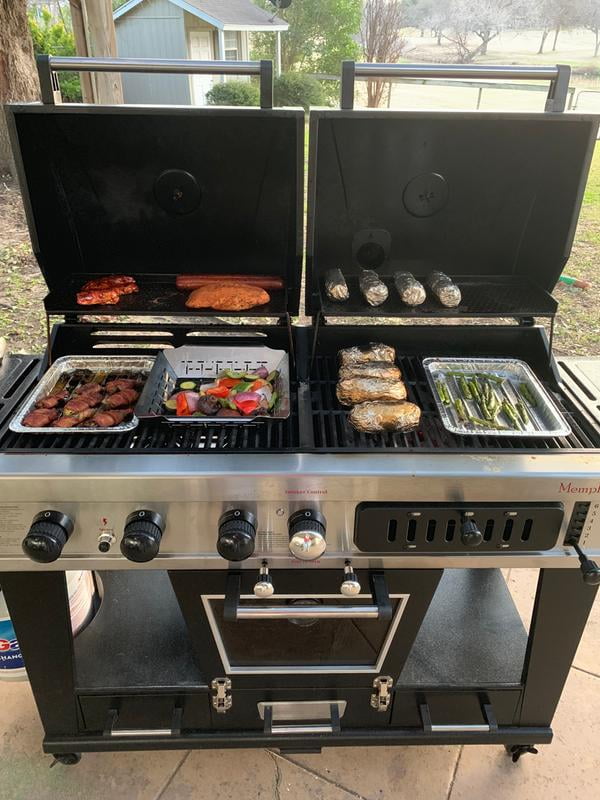
I want to click on knob, so click(472, 536).